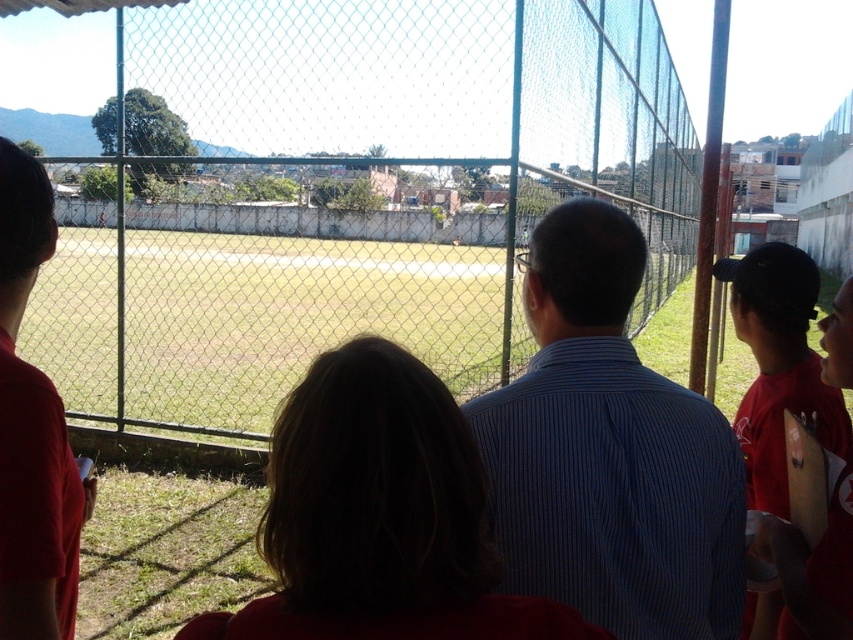
Is metal mesh fence at center closer to the viewer compared to blue striped shirt at center?

No, it is not.

At what (x,y) coordinates should I click in order to perform the action: click on metal mesh fence at center. Please return your answer as a coordinate pair (x, y). This screenshot has width=853, height=640. Looking at the image, I should click on pyautogui.click(x=338, y=189).

Is red shirt at left smaller than red cotton shirt at right?

Correct, red shirt at left occupies less space than red cotton shirt at right.

Is point (49, 413) positioned before point (775, 426)?

Yes, point (49, 413) is in front of point (775, 426).

What are the coordinates of `red shirt at left` in the screenshot? It's located at (32, 428).

Can you confirm if blue striped shirt at center is positioned to the right of red shirt at left?

Correct, you'll find blue striped shirt at center to the right of red shirt at left.

This screenshot has width=853, height=640. Describe the element at coordinates (608, 452) in the screenshot. I see `blue striped shirt at center` at that location.

Image resolution: width=853 pixels, height=640 pixels. Identify the location of blue striped shirt at center. (608, 452).